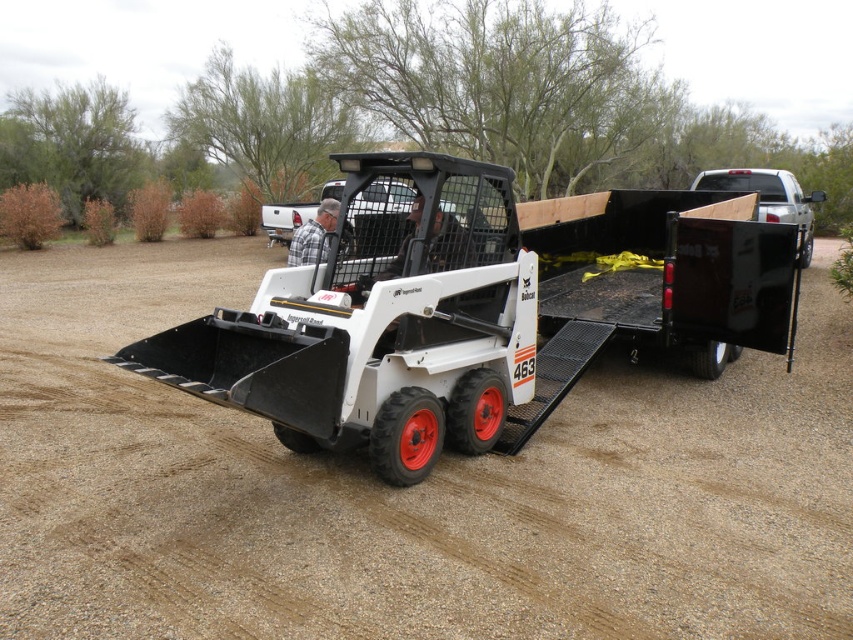
You are a delivery person needing to drive a small cart through the area. The cart requires a path wider than the plaid fabric shirt at center. Can the dirt track at center accommodate your cart?

The dirt track at center is wider than the plaid fabric shirt at center, so yes, the cart can use the dirt track at center as the path meets the required width.